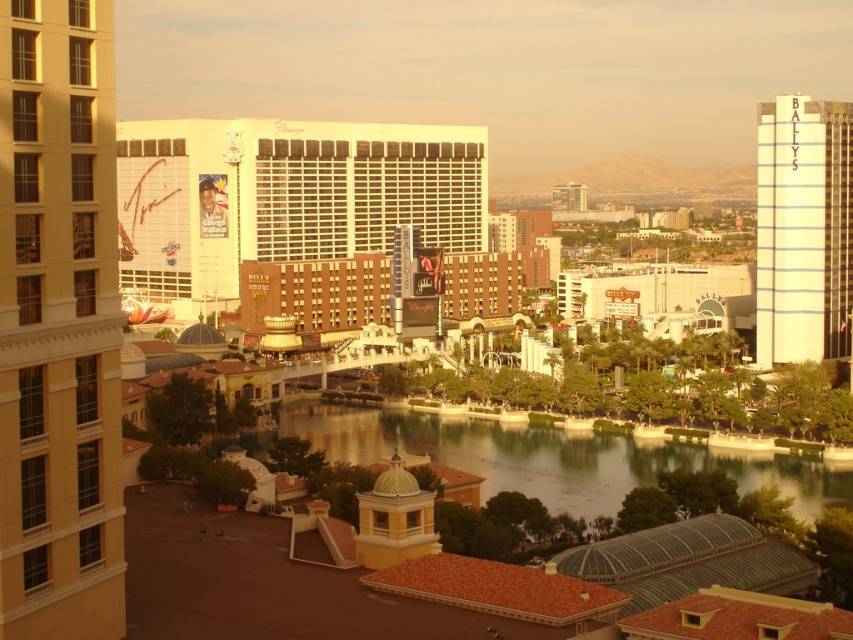
Question: Observing the image, what is the correct spatial positioning of white glossy hotel at center in reference to brown brick hotel at center?

Choices:
 (A) below
 (B) above

Answer: (B)

Question: Does brown brick hotel at center appear over matte glass building at center?

Choices:
 (A) yes
 (B) no

Answer: (B)

Question: Among these objects, which one is nearest to the camera?

Choices:
 (A) greenish water at center
 (B) matte glass building at center
 (C) brown brick hotel at center

Answer: (A)

Question: Is white glass building at upper right behind brown brick hotel at center?

Choices:
 (A) no
 (B) yes

Answer: (A)

Question: Which of the following is the farthest from the observer?

Choices:
 (A) beige stone building at left
 (B) white glossy hotel at center

Answer: (B)

Question: Among these points, which one is farthest from the camera?

Choices:
 (A) (572, 208)
 (B) (845, 356)
 (C) (73, 400)
 (D) (477, 448)

Answer: (A)